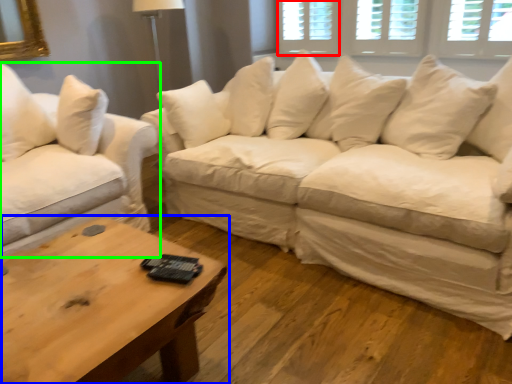
Question: Which object is the closest to the window (highlighted by a red box)? Choose among these: coffee table (highlighted by a blue box) or studio couch (highlighted by a green box).

Choices:
 (A) coffee table
 (B) studio couch

Answer: (B)